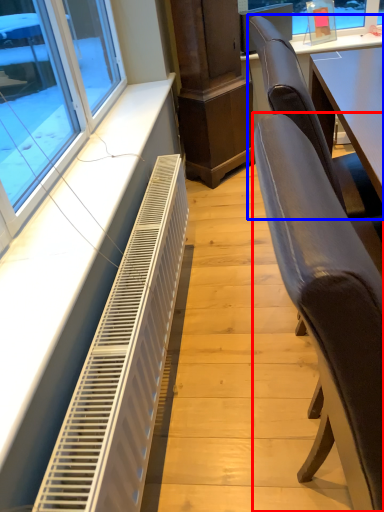
Question: Which object is further to the camera taking this photo, chair (highlighted by a red box) or chair (highlighted by a blue box)?

Choices:
 (A) chair
 (B) chair

Answer: (B)